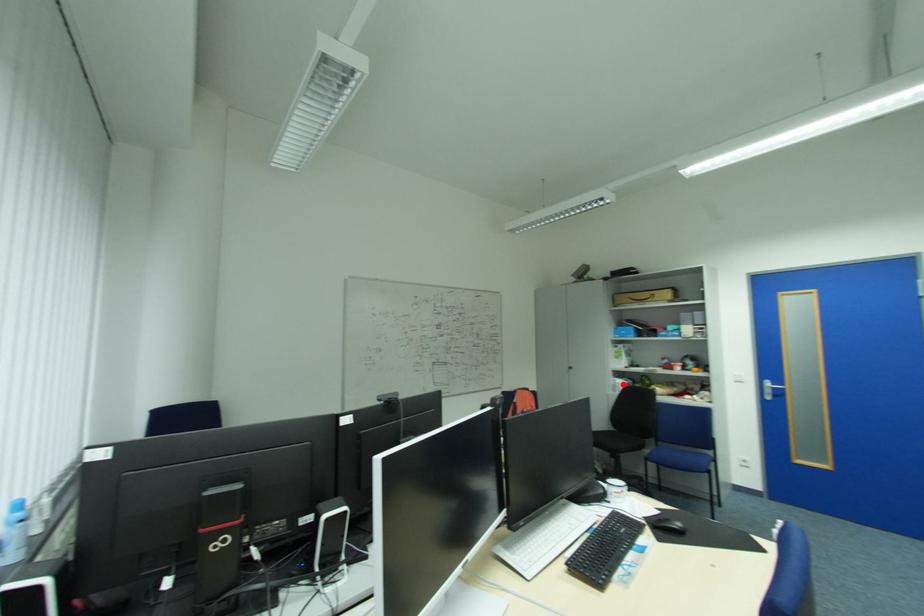
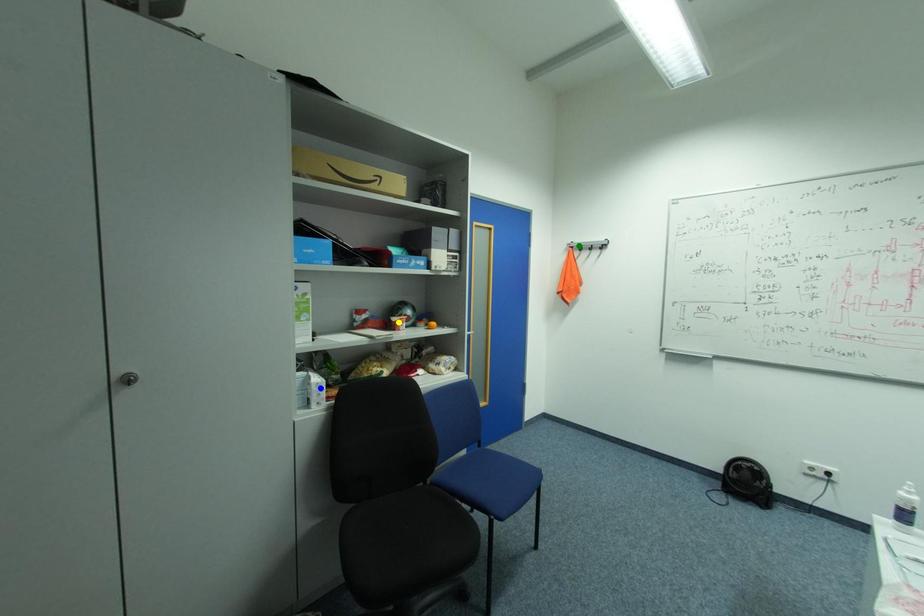
Question: I am providing you with two images of the same scene from different viewpoints. A red point is marked on the first image. You are given multiple points on the second image. In image 2, which mark is for the same physical point as the one in image 1?

Choices:
 (A) yellow point
 (B) green point
 (C) blue point

Answer: (C)